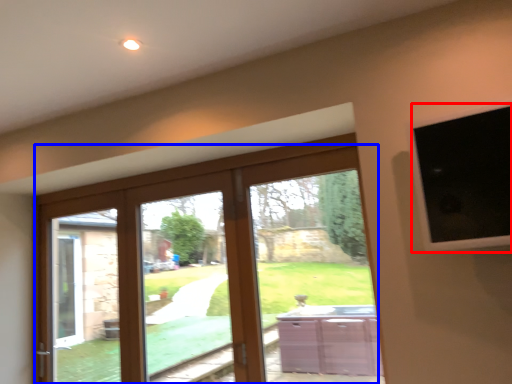
Question: Which object appears closest to the camera in this image, window screen (highlighted by a red box) or door (highlighted by a blue box)?

Choices:
 (A) window screen
 (B) door

Answer: (A)